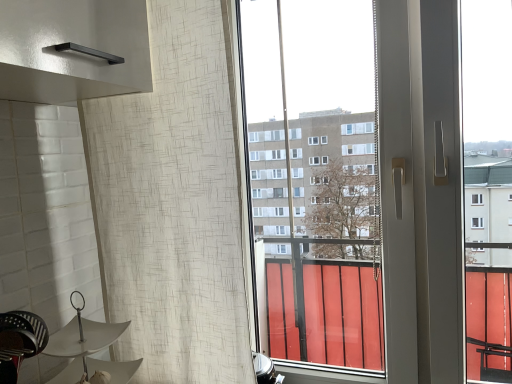
Question: Considering the relative sizes of white textured curtain at left and white matte umbrella at lower left in the image provided, is white textured curtain at left taller than white matte umbrella at lower left?

Choices:
 (A) yes
 (B) no

Answer: (A)

Question: Considering the relative positions of white textured curtain at left and white matte umbrella at lower left in the image provided, is white textured curtain at left behind white matte umbrella at lower left?

Choices:
 (A) yes
 (B) no

Answer: (A)

Question: Is white textured curtain at left placed right next to white matte umbrella at lower left?

Choices:
 (A) no
 (B) yes

Answer: (A)

Question: From a real-world perspective, is white textured curtain at left located higher than white matte umbrella at lower left?

Choices:
 (A) no
 (B) yes

Answer: (B)

Question: Is white textured curtain at left shorter than white matte umbrella at lower left?

Choices:
 (A) yes
 (B) no

Answer: (B)

Question: From the image's perspective, is white matte umbrella at lower left above or below white textured curtain at left?

Choices:
 (A) above
 (B) below

Answer: (B)

Question: In the image, is white matte umbrella at lower left positioned in front of or behind white textured curtain at left?

Choices:
 (A) behind
 (B) front

Answer: (B)

Question: Considering the positions of point (110, 344) and point (99, 210), is point (110, 344) closer or farther from the camera than point (99, 210)?

Choices:
 (A) farther
 (B) closer

Answer: (B)

Question: From a real-world perspective, is white matte umbrella at lower left above or below white textured curtain at left?

Choices:
 (A) below
 (B) above

Answer: (A)

Question: From a real-world perspective, relative to white matte umbrella at lower left, is white textured curtain at left vertically above or below?

Choices:
 (A) above
 (B) below

Answer: (A)

Question: Is white textured curtain at left taller or shorter than white matte umbrella at lower left?

Choices:
 (A) tall
 (B) short

Answer: (A)

Question: Is white textured curtain at left wider or thinner than white matte umbrella at lower left?

Choices:
 (A) thin
 (B) wide

Answer: (A)

Question: Is white textured curtain at left in front of or behind white matte umbrella at lower left in the image?

Choices:
 (A) front
 (B) behind

Answer: (B)

Question: Is metallic black swivel chair at lower left in front of or behind white matte umbrella at lower left in the image?

Choices:
 (A) front
 (B) behind

Answer: (A)

Question: From a real-world perspective, is metallic black swivel chair at lower left positioned above or below white matte umbrella at lower left?

Choices:
 (A) above
 (B) below

Answer: (A)